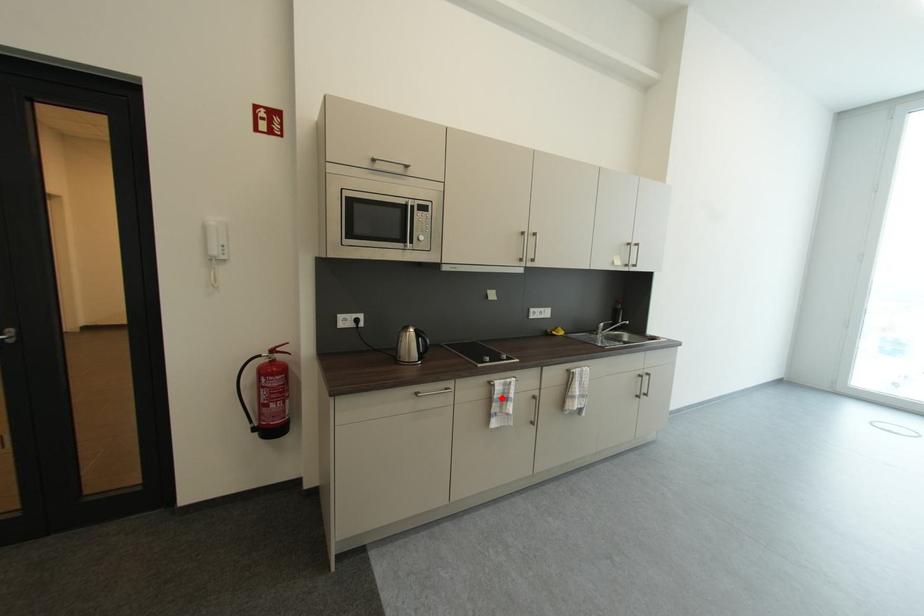
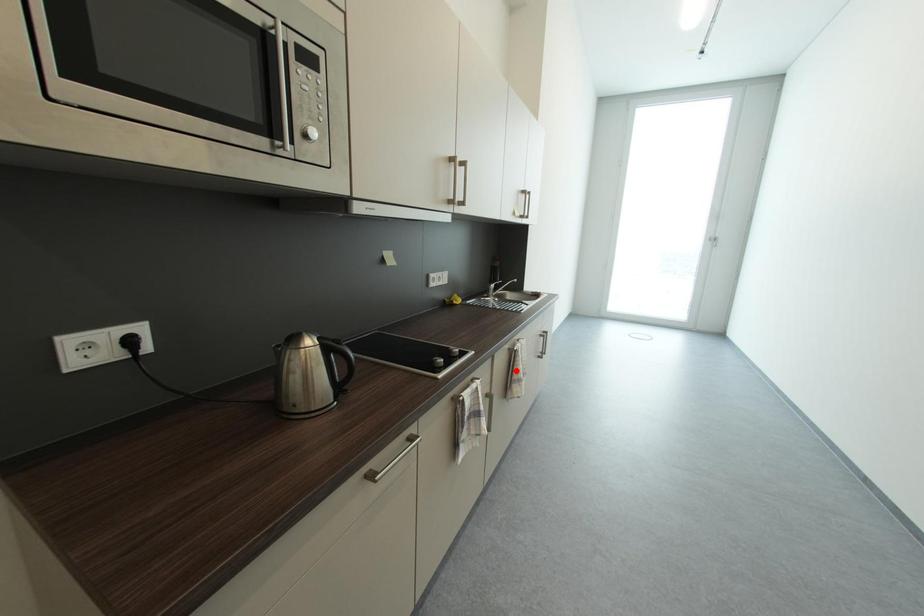
I am providing you with two images of the same scene from different viewpoints. A red point is marked on the first image and another point is marked on the second image. Is the marked point in image1 the same physical position as the marked point in image2?

No